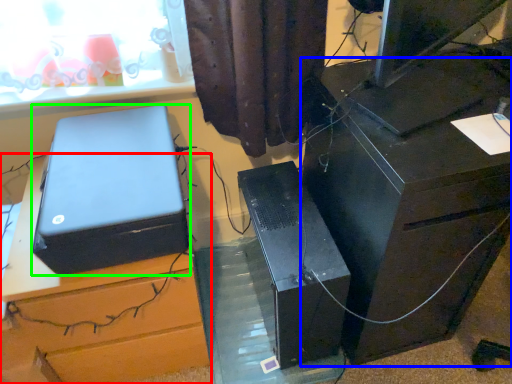
Question: Considering the real-world distances, which object is farthest from furniture (highlighted by a red box)? furniture (highlighted by a blue box) or box (highlighted by a green box)?

Choices:
 (A) furniture
 (B) box

Answer: (A)